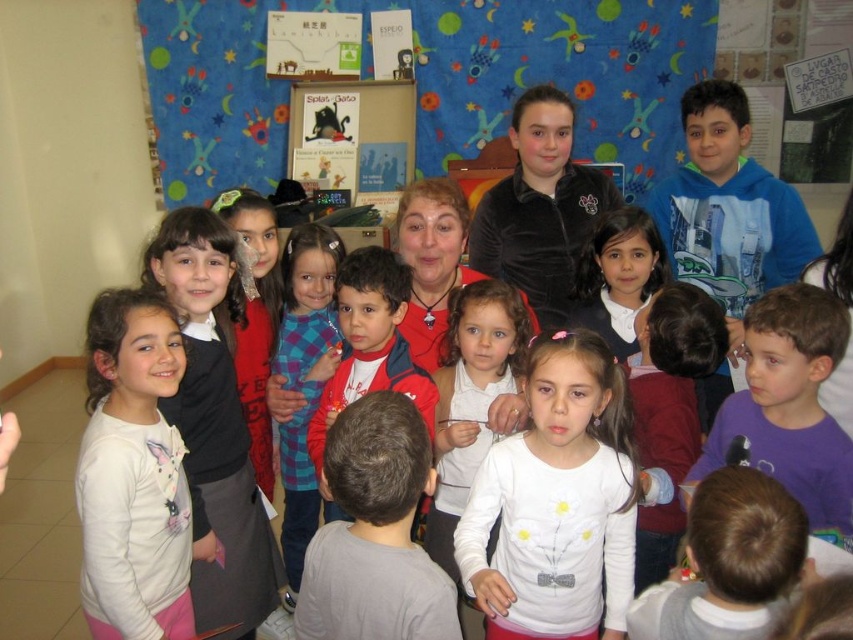
You are a teacher organizing a classroom. You need to place the matte red sweater at center on a shelf. Given that the matte cardboard bookshelf at upper center is the only shelf available, will the sweater fit on it?

The matte cardboard bookshelf at upper center is larger in size than the matte red sweater at center, so the sweater will fit on the shelf.

You are standing in the classroom and want to move from point A to point B. If point A is at coordinate point (132, 632) and point B is at coordinate point (386, 372), which direction should you move to go from point A to point B?

To move from point A at coordinate point (132, 632) to point B at coordinate point (386, 372), you should move towards the upper left direction since point A is in front of point B.

You are standing in the classroom and need to find the gray cotton shirt at center. According to the coordinates provided, where exactly should you look to locate it?

The gray cotton shirt at center is located at point 0.834 on the x axis and 0.441 on the y axis.